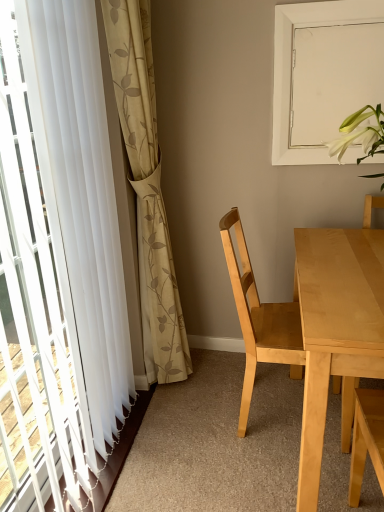
Locate an element on the screen. The width and height of the screenshot is (384, 512). vacant space underneath light wood chair at center (from a real-world perspective) is located at coordinates (276, 412).